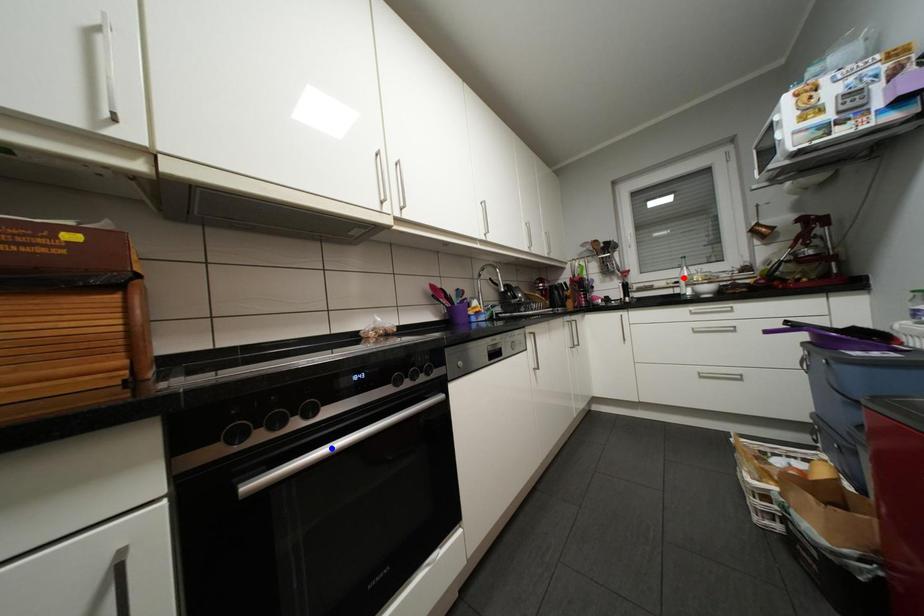
Question: Two points are marked on the image. Which point is closer to the camera?

Choices:
 (A) Blue point is closer.
 (B) Red point is closer.

Answer: (A)